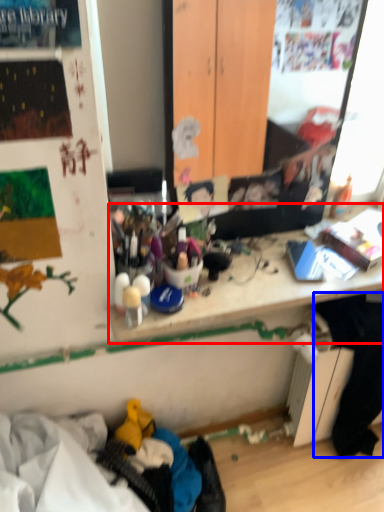
Question: Among these objects, which one is nearest to the camera, writing desk (highlighted by a red box) or clothing (highlighted by a blue box)?

Choices:
 (A) writing desk
 (B) clothing

Answer: (A)